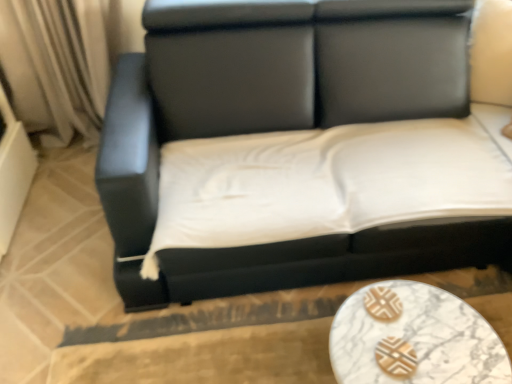
The image size is (512, 384). Describe the element at coordinates (414, 338) in the screenshot. I see `white marble table at lower center` at that location.

Where is `white marble table at lower center`? The height and width of the screenshot is (384, 512). white marble table at lower center is located at coordinates (414, 338).

What do you see at coordinates (298, 148) in the screenshot? I see `black leather couch at center` at bounding box center [298, 148].

You are a GUI agent. You are given a task and a screenshot of the screen. Output one action in this format:
    pyautogui.click(x=<x>, y=<y>)
    Task: Click on the black leather couch at center
    
    Given the screenshot: What is the action you would take?
    pyautogui.click(x=298, y=148)

At what (x,y) coordinates should I click in order to perform the action: click on white marble table at lower center. Please return your answer as a coordinate pair (x, y). The height and width of the screenshot is (384, 512). Looking at the image, I should click on (414, 338).

Does black leather couch at center appear on the right side of white marble table at lower center?

Incorrect, black leather couch at center is not on the right side of white marble table at lower center.

Between black leather couch at center and white marble table at lower center, which one is positioned behind?

white marble table at lower center.

Is point (418, 124) closer to camera compared to point (501, 377)?

No, it is behind (501, 377).

From the image's perspective, which one is positioned lower, black leather couch at center or white marble table at lower center?

white marble table at lower center.

Based on the photo, from a real-world perspective, is black leather couch at center on white marble table at lower center?

Yes, from a real-world perspective, black leather couch at center is on top of white marble table at lower center.

Between black leather couch at center and white marble table at lower center, which one has larger width?

Wider between the two is black leather couch at center.

Considering the sizes of objects black leather couch at center and white marble table at lower center in the image provided, who is shorter, black leather couch at center or white marble table at lower center?

Standing shorter between the two is white marble table at lower center.

Can you confirm if black leather couch at center is bigger than white marble table at lower center?

Correct, black leather couch at center is larger in size than white marble table at lower center.

In the scene shown: Would you say black leather couch at center is inside or outside white marble table at lower center?

black leather couch at center is spatially situated outside white marble table at lower center.

Are black leather couch at center and white marble table at lower center far apart?

No, black leather couch at center is not far away from white marble table at lower center.

Is black leather couch at center facing towards white marble table at lower center?

Yes, black leather couch at center is turned towards white marble table at lower center.

Measure the distance between black leather couch at center and white marble table at lower center.

21.98 inches.

Where is `studio couch lying in front of the white marble table at lower center`? studio couch lying in front of the white marble table at lower center is located at coordinates (298, 148).

Between white marble table at lower center and black leather couch at center, which one appears on the left side from the viewer's perspective?

Positioned to the left is black leather couch at center.

Considering their positions, is white marble table at lower center located in front of or behind black leather couch at center?

Clearly, white marble table at lower center is behind black leather couch at center.

Which is behind, point (487, 378) or point (185, 102)?

The point (185, 102) is behind.

From the image's perspective, which object appears higher, white marble table at lower center or black leather couch at center?

black leather couch at center is shown above in the image.

From a real-world perspective, is white marble table at lower center on black leather couch at center?

Incorrect, from a real-world perspective, white marble table at lower center is lower than black leather couch at center.

Can you confirm if white marble table at lower center is thinner than black leather couch at center?

Yes.

Does white marble table at lower center have a lesser height compared to black leather couch at center?

→ Yes.

Can you confirm if white marble table at lower center is smaller than black leather couch at center?

Correct, white marble table at lower center occupies less space than black leather couch at center.

Would you say white marble table at lower center is inside or outside black leather couch at center?

white marble table at lower center is not inside black leather couch at center, it's outside.

Is white marble table at lower center touching black leather couch at center?

There is a gap between white marble table at lower center and black leather couch at center.

Is white marble table at lower center positioned with its back to black leather couch at center?

Yes, black leather couch at center is at the back of white marble table at lower center.

Where is `table below the black leather couch at center (from a real-world perspective)`? Image resolution: width=512 pixels, height=384 pixels. table below the black leather couch at center (from a real-world perspective) is located at coordinates tap(414, 338).

Locate an element on the screen. studio couch above the white marble table at lower center (from a real-world perspective) is located at coordinates (298, 148).

The image size is (512, 384). Find the location of `studio couch in front of the white marble table at lower center`. studio couch in front of the white marble table at lower center is located at coordinates (298, 148).